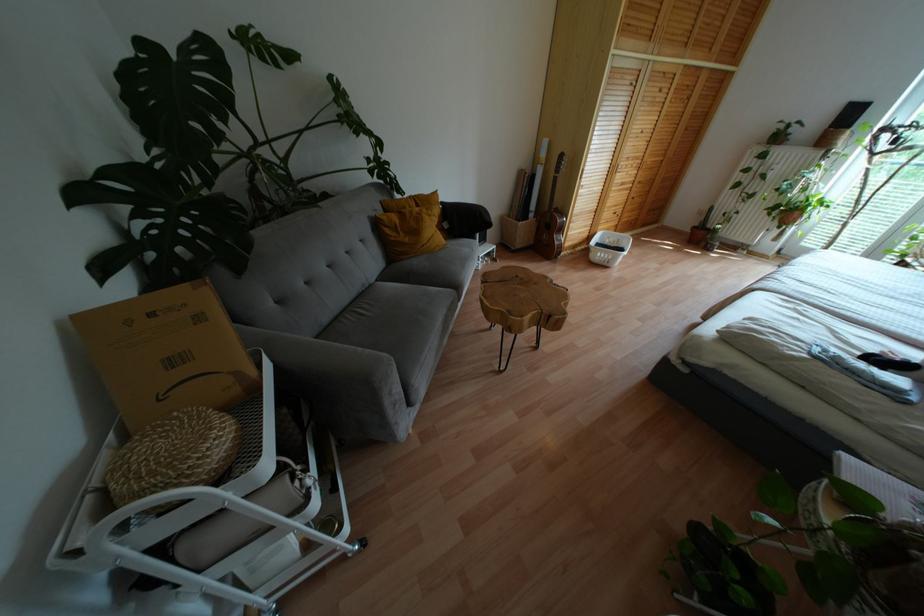
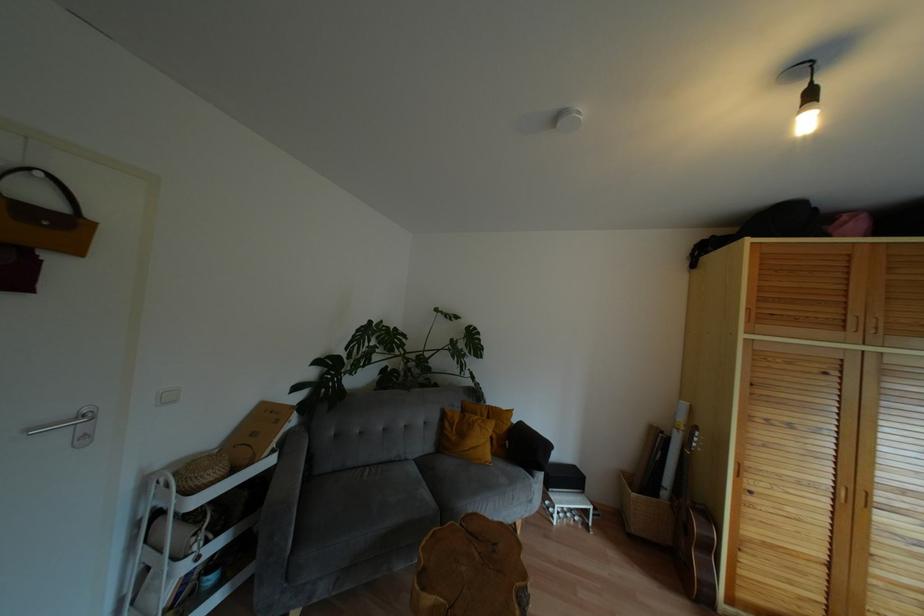
In the second image, find the point that corresponds to point (463, 220) in the first image.

(524, 448)